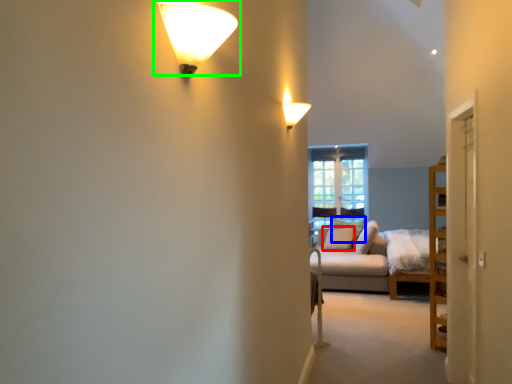
Question: Which object is positioned closest to pillow (highlighted by a red box)? Select from pillow (highlighted by a blue box) and lamp (highlighted by a green box).

Choices:
 (A) pillow
 (B) lamp

Answer: (A)